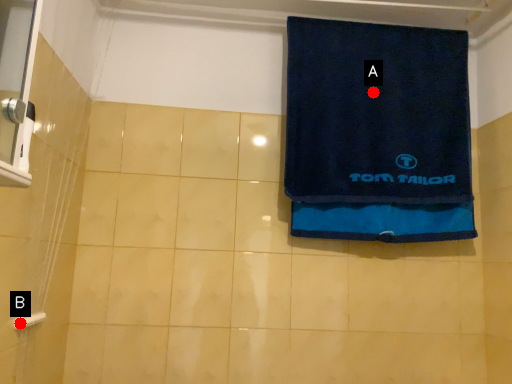
Question: Two points are circled on the image, labeled by A and B beside each circle. Among these points, which one is farthest from the camera?

Choices:
 (A) A is further
 (B) B is further

Answer: (A)